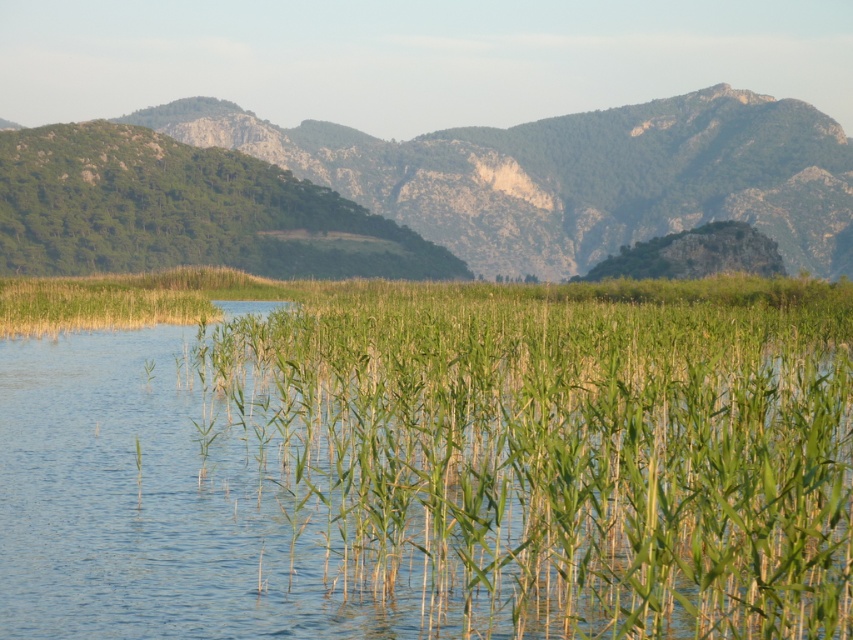
Based on the scene description, where exactly is the green leafy grass at center located in terms of coordinates?

The green leafy grass at center is located at point coordinates of (555, 445).

You are standing in the middle of the scene and want to place a small decorative stone between the green leafy grass at center and the green textured grass at upper center. Which direction should you move the stone to ensure it is placed between them?

To place the small decorative stone between the green leafy grass at center and the green textured grass at upper center, you should move it upwards since the green textured grass at upper center is positioned above the green leafy grass at center.